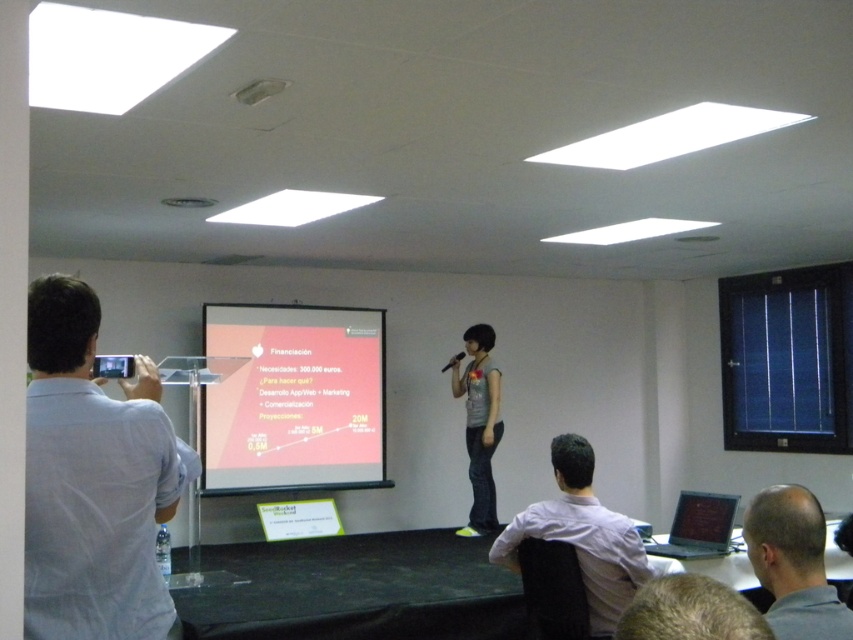
Who is positioned more to the right, matte orange projector screen at center or bald head at center?

Positioned to the right is bald head at center.

Is matte orange projector screen at center thinner than bald head at center?

Incorrect, matte orange projector screen at center's width is not less than bald head at center's.

Who is more forward, (322, 356) or (781, 586)?

Point (781, 586) is more forward.

Locate an element on the screen. matte orange projector screen at center is located at coordinates (294, 397).

Looking at this image, can you confirm if white shirt at lower right is thinner than matte gray shirt at center?

Incorrect, white shirt at lower right's width is not less than matte gray shirt at center's.

Does point (624, 608) lie behind point (496, 392)?

No.

Who is more distant from viewer, (573, 536) or (468, 344)?

Point (468, 344)

The width and height of the screenshot is (853, 640). What are the coordinates of `white shirt at lower right` in the screenshot? It's located at (581, 534).

Does bald head at center have a lesser width compared to matte gray shirt at center?

Yes.

Can you confirm if bald head at center is shorter than matte gray shirt at center?

Correct, bald head at center is not as tall as matte gray shirt at center.

Locate an element on the screen. The width and height of the screenshot is (853, 640). bald head at center is located at coordinates (793, 564).